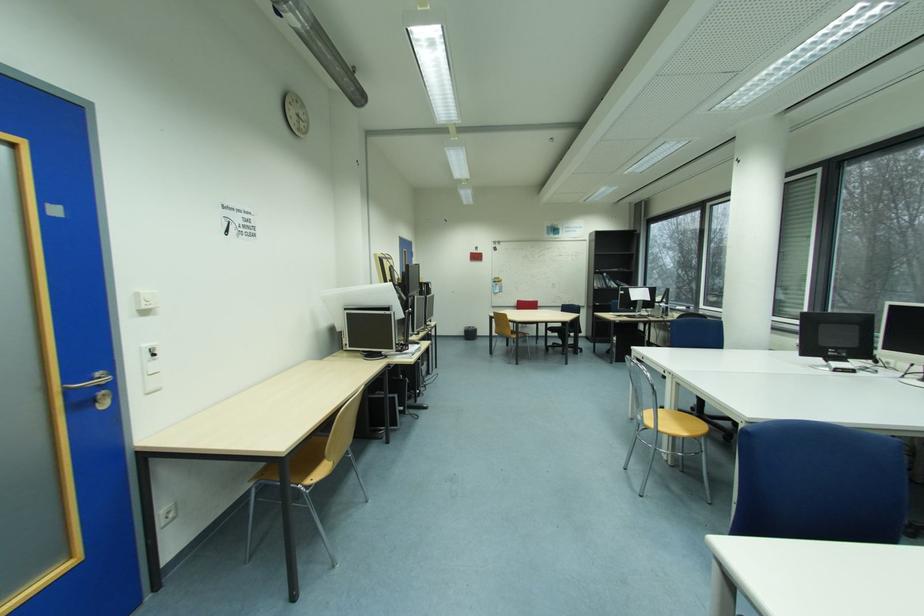
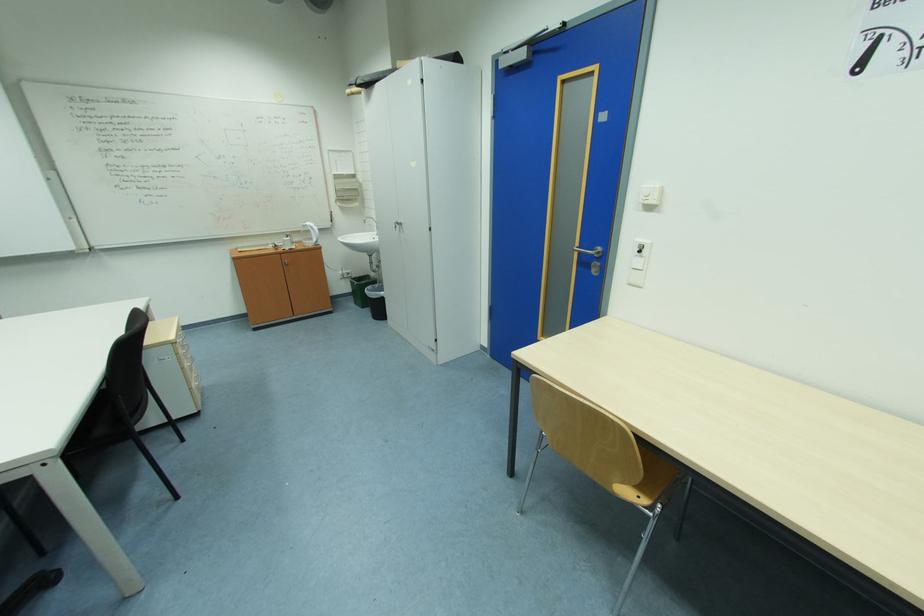
Locate, in the second image, the point that corresponds to pixel 155 394 in the first image.

(638, 286)